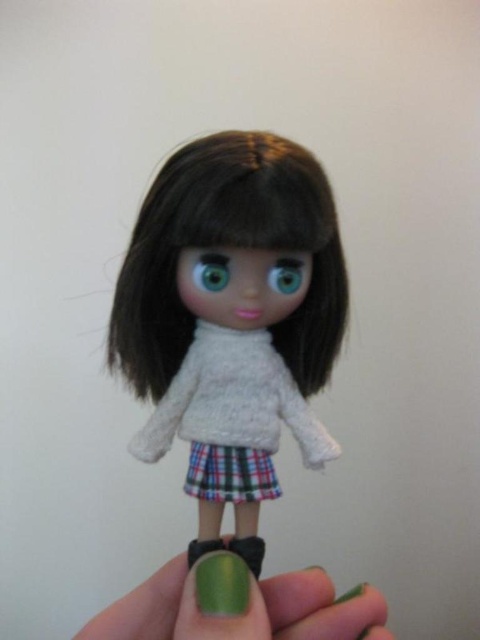
Based on the photo, based on the scene description, which object is wider, the green metallic nail polish at lower center or the blue glossy eye at center?

The green metallic nail polish at lower center might be wider than the blue glossy eye at center according to the description.

You are a photographer taking a picture of the doll. You notice two points on the doll, one at point (x=283, y=627) and the other at point (x=288, y=285). If you want to focus on the point that is closer to the camera, which coordinate should you choose?

Point (x=288, y=285) is closer to the camera than point (x=283, y=627), so you should focus on point (x=288, y=285).

You are a fashion designer examining the doll. You notice the green metallic nail polish at lower center and the green matte eye at center. Which object is located to the left of the other?

The green metallic nail polish at lower center is positioned on the left side of green matte eye at center.